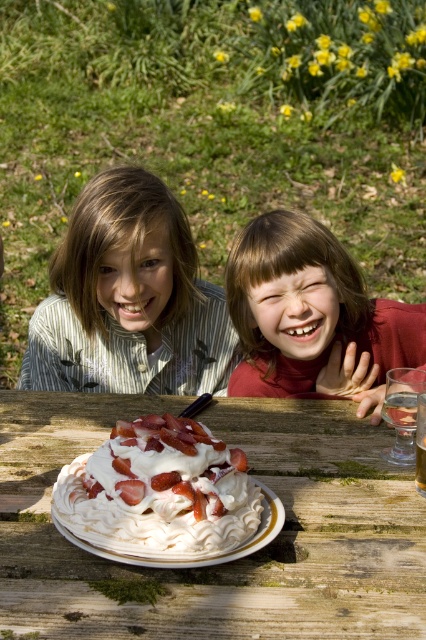
Question: Which point is farther to the camera?

Choices:
 (A) (189, 420)
 (B) (60, 452)
 (C) (417, 404)
 (D) (313, 266)

Answer: (D)

Question: Does matte red shirt at center have a lesser width compared to whipped cream topped strawberry cake at center?

Choices:
 (A) yes
 (B) no

Answer: (B)

Question: Which point is farther from the camera taking this photo?

Choices:
 (A) [x=131, y=490]
 (B) [x=373, y=611]

Answer: (A)

Question: Which of these objects is positioned closest to the whipped cream topped strawberry cake at center?

Choices:
 (A) white fluffy frosting at center
 (B) matte red shirt at center

Answer: (A)

Question: Does white wooden table at center lie in front of clear glass water at table center?

Choices:
 (A) yes
 (B) no

Answer: (A)

Question: Is matte red shirt at center positioned before white fluffy frosting at center?

Choices:
 (A) no
 (B) yes

Answer: (A)